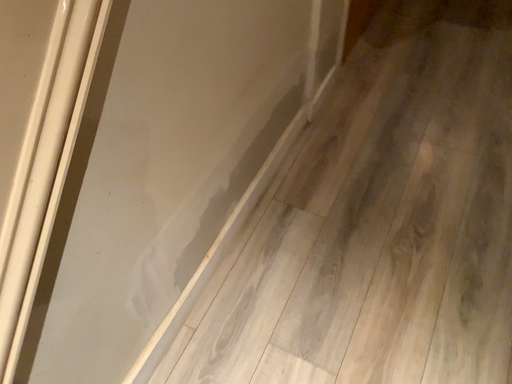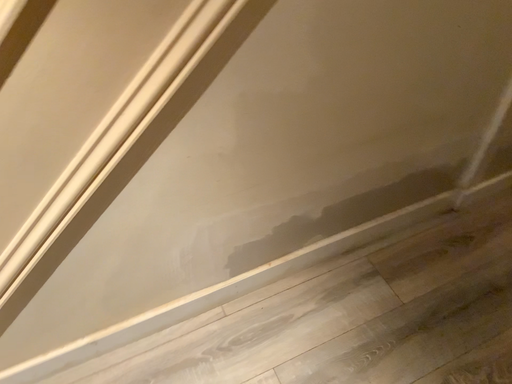
Question: Which way did the camera rotate in the video?

Choices:
 (A) rotated upward
 (B) rotated downward

Answer: (A)